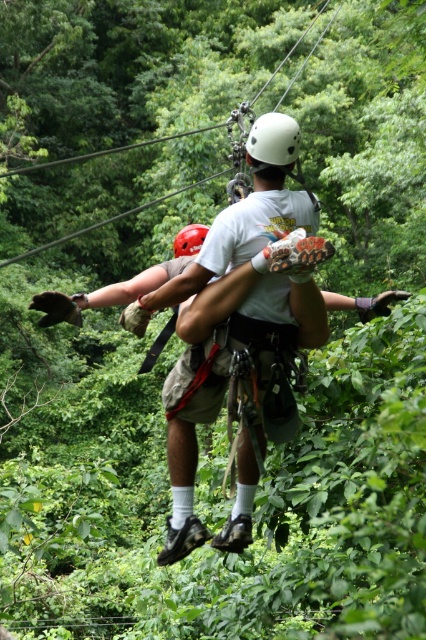
Question: Is matte white helmet at center further to camera compared to white matte helmet at center?

Choices:
 (A) no
 (B) yes

Answer: (A)

Question: In this image, where is matte white helmet at center located relative to white matte helmet at center?

Choices:
 (A) right
 (B) left

Answer: (B)

Question: Can you confirm if matte white helmet at center is positioned to the left of white matte helmet at center?

Choices:
 (A) yes
 (B) no

Answer: (A)

Question: Which object is closer to the camera taking this photo?

Choices:
 (A) matte white helmet at center
 (B) white matte helmet at center

Answer: (A)

Question: Which point is closer to the camera?

Choices:
 (A) (293, 147)
 (B) (169, 476)

Answer: (A)

Question: Among these objects, which one is nearest to the camera?

Choices:
 (A) matte white helmet at center
 (B) white matte helmet at center

Answer: (A)